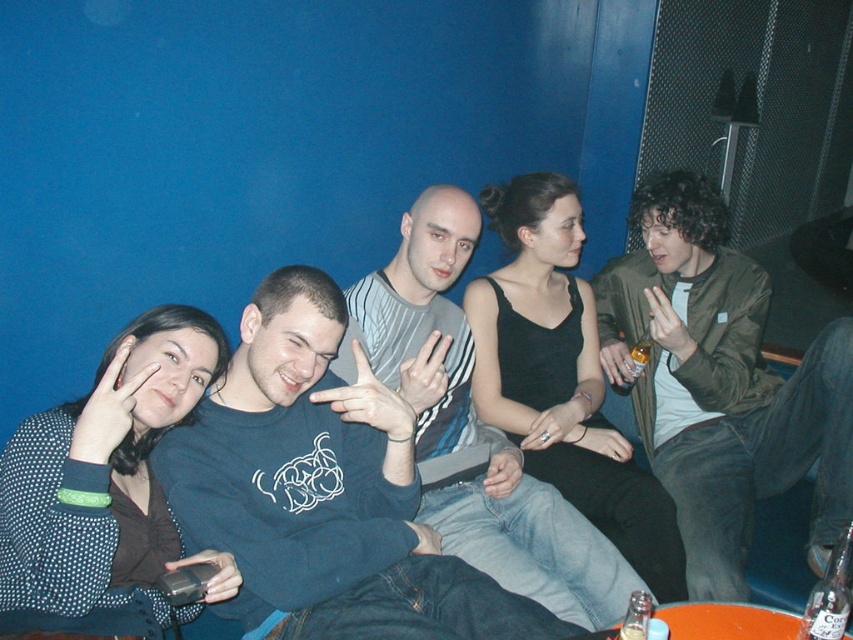
Question: Can you confirm if green matte jacket at right is wider than striped jersey at center?

Choices:
 (A) no
 (B) yes

Answer: (A)

Question: Can you confirm if blue sweatshirt at center is positioned to the right of green matte jacket at right?

Choices:
 (A) yes
 (B) no

Answer: (B)

Question: Which is nearer to the blue sweatshirt at center?

Choices:
 (A) green matte jacket at right
 (B) striped jersey at center

Answer: (B)

Question: Considering the real-world distances, which object is closest to the green matte jacket at right?

Choices:
 (A) blue sweatshirt at center
 (B) striped jersey at center

Answer: (B)

Question: Which object is the closest to the striped jersey at center?

Choices:
 (A) blue sweatshirt at center
 (B) green matte jacket at right

Answer: (A)

Question: Can you confirm if blue sweatshirt at center is positioned to the right of striped jersey at center?

Choices:
 (A) no
 (B) yes

Answer: (A)